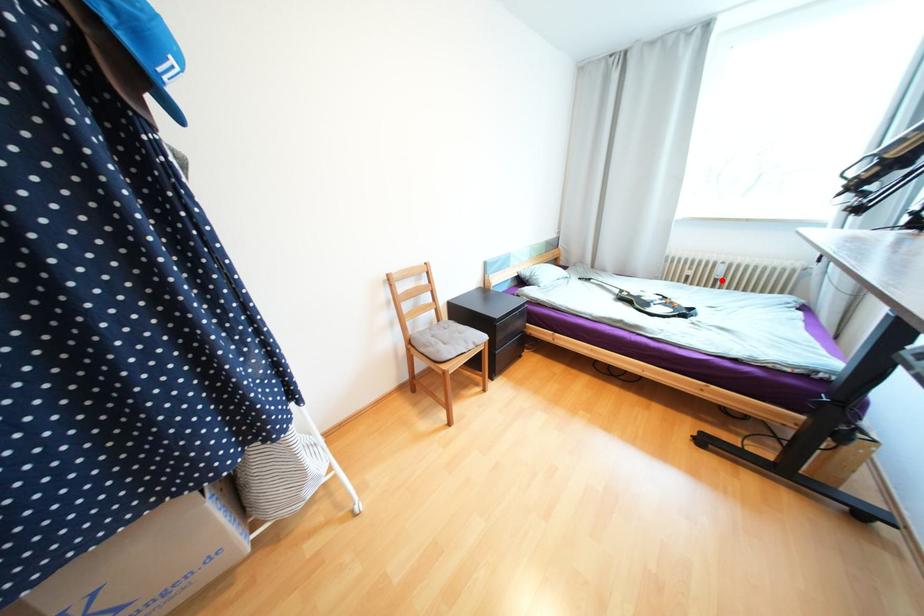
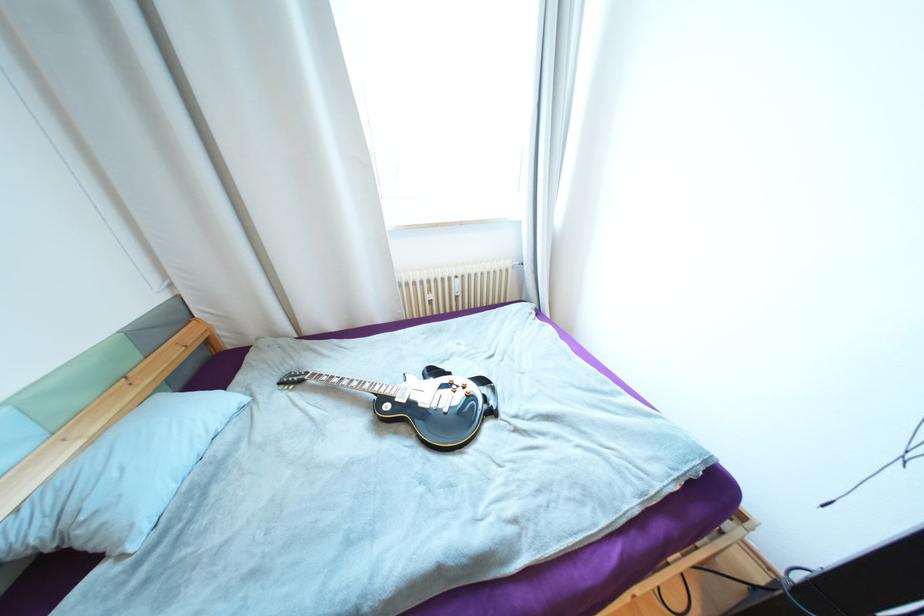
Find the pixel in the second image that matches the highlighted location in the first image.

(463, 297)